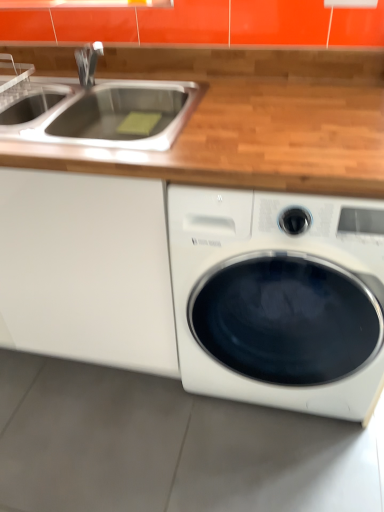
Question: In terms of size, does white glossy washing machine at lower right appear bigger or smaller than white matte cabinet at left?

Choices:
 (A) small
 (B) big

Answer: (A)

Question: From a real-world perspective, is white glossy washing machine at lower right above or below white matte cabinet at left?

Choices:
 (A) below
 (B) above

Answer: (B)

Question: Estimate the real-world distances between objects in this image. Which object is farther from the white glossy washing machine at lower right?

Choices:
 (A) stainless steel sink at upper left
 (B) white matte cabinet at left

Answer: (A)

Question: Considering the real-world distances, which object is closest to the white glossy washing machine at lower right?

Choices:
 (A) white matte cabinet at left
 (B) stainless steel sink at upper left

Answer: (A)